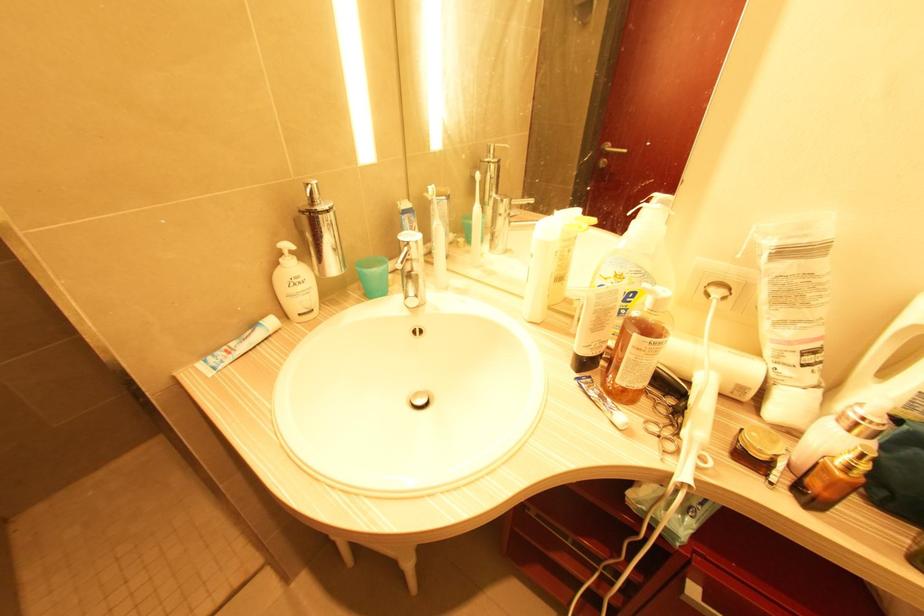
This screenshot has height=616, width=924. Describe the element at coordinates (609, 152) in the screenshot. I see `the door handle` at that location.